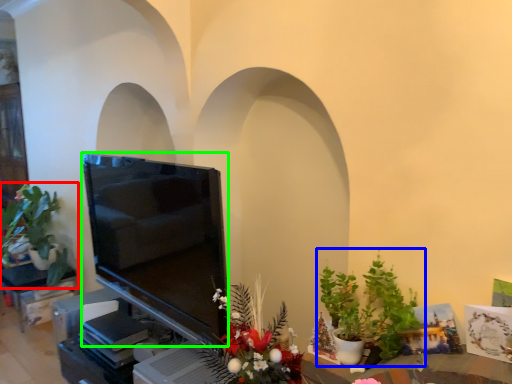
Question: Which object is the farthest from houseplant (highlighted by a red box)? Choose among these: houseplant (highlighted by a blue box) or television (highlighted by a green box).

Choices:
 (A) houseplant
 (B) television

Answer: (A)